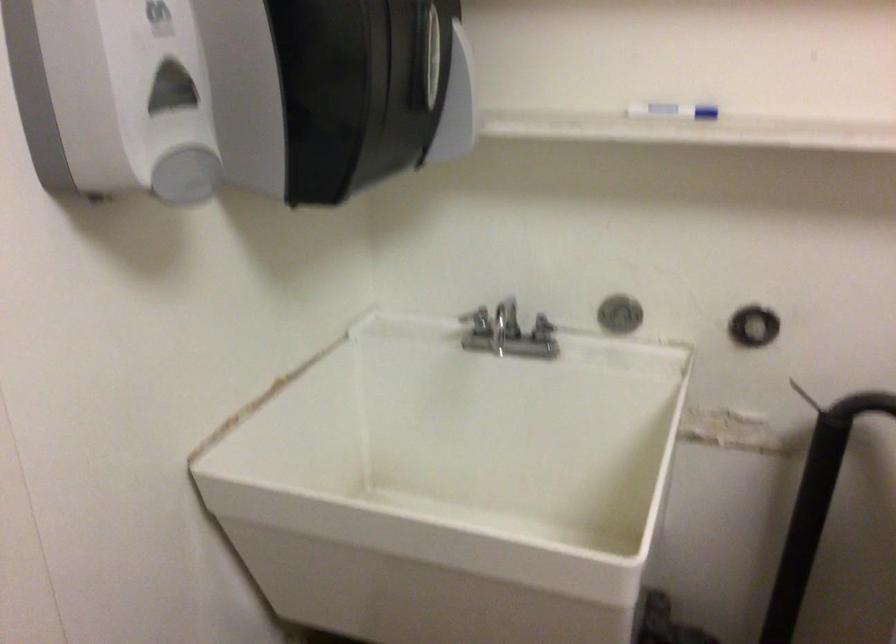
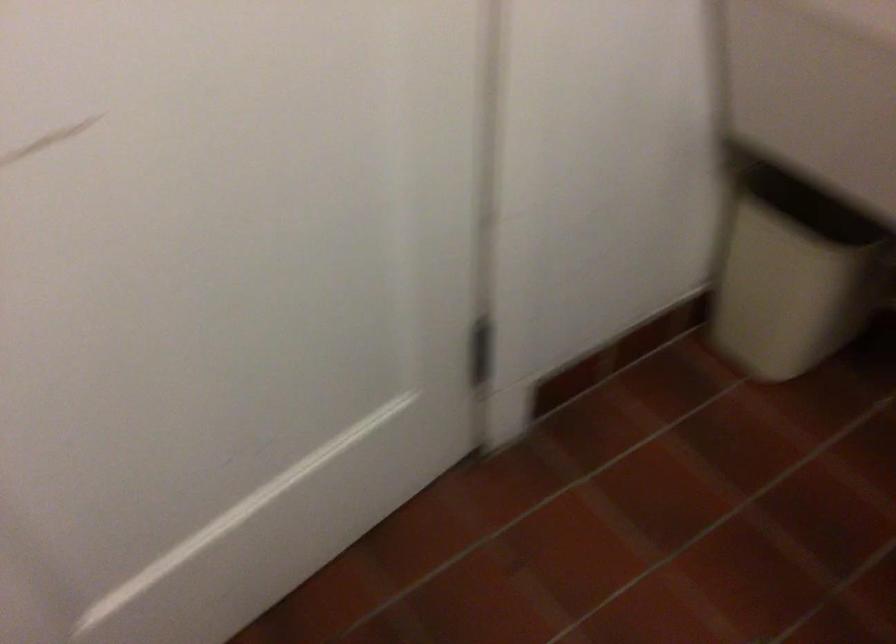
From the picture: First-person continuous shooting, in which direction is the camera rotating?

The camera rotated toward left-down.